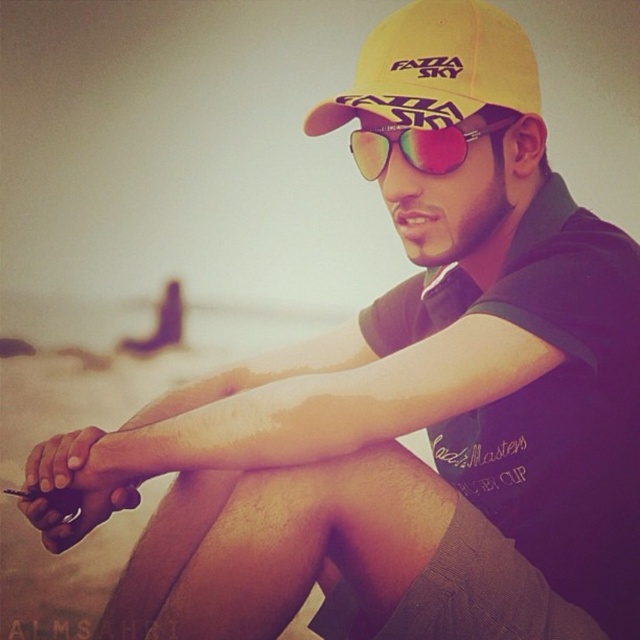
Which is above, yellow fabric baseball cap at upper center or multicolored reflective sunglasses at center?

yellow fabric baseball cap at upper center is above.

Which of these two, yellow fabric baseball cap at upper center or multicolored reflective sunglasses at center, stands shorter?

With less height is multicolored reflective sunglasses at center.

The height and width of the screenshot is (640, 640). What do you see at coordinates (435, 68) in the screenshot?
I see `yellow fabric baseball cap at upper center` at bounding box center [435, 68].

Identify the location of yellow fabric baseball cap at upper center. coord(435,68).